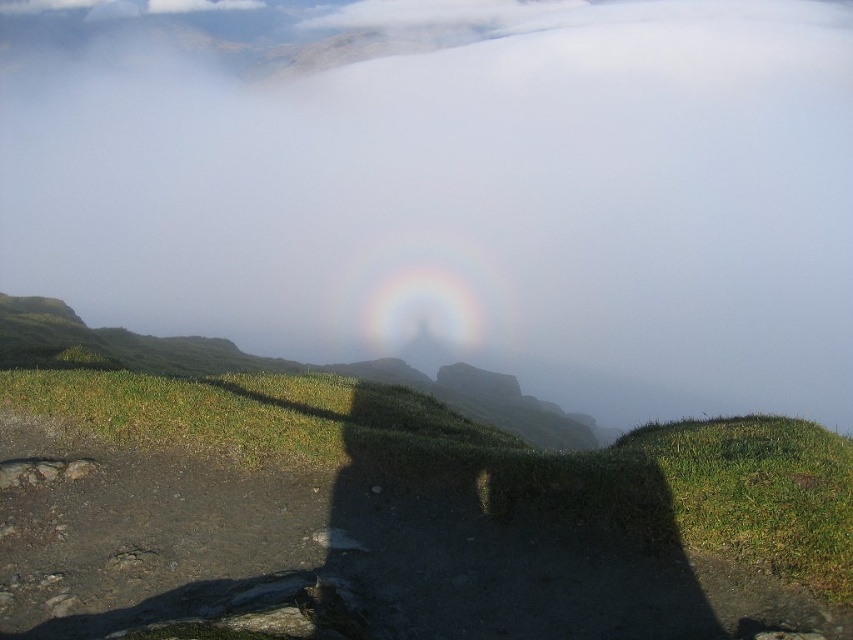
Question: Does transparent mist at center appear on the left side of green grassy hill at lower right?

Choices:
 (A) no
 (B) yes

Answer: (A)

Question: Which point appears closest to the camera in this image?

Choices:
 (A) (781, 342)
 (B) (729, 508)

Answer: (B)

Question: Is transparent mist at center above green grassy hill at lower right?

Choices:
 (A) no
 (B) yes

Answer: (B)

Question: Does transparent mist at center have a smaller size compared to green grassy hill at lower right?

Choices:
 (A) no
 (B) yes

Answer: (A)